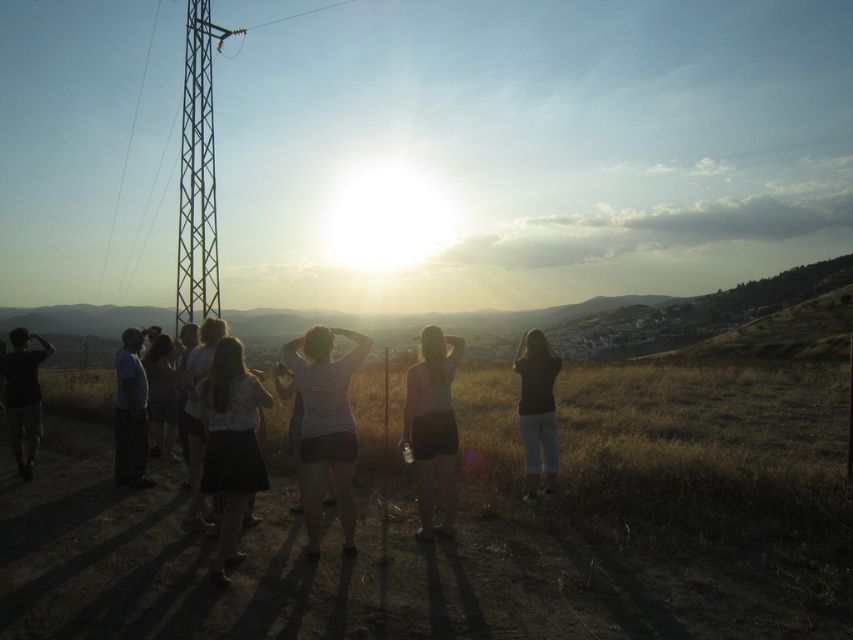
Is black cotton shirt at right above dark gray pants at left?

Yes, black cotton shirt at right is above dark gray pants at left.

Is black cotton shirt at right to the right of dark gray pants at left from the viewer's perspective?

Yes, black cotton shirt at right is to the right of dark gray pants at left.

Find the location of `black cotton shirt at right`. black cotton shirt at right is located at coordinates (537, 410).

Which of these two, silhouette group at center or black cotton shirt at right, stands shorter?

silhouette group at center

Is point (273, 513) behind point (515, 368)?

No.

Which is behind, point (733, 509) or point (524, 340)?

Positioned behind is point (524, 340).

This screenshot has width=853, height=640. Find the location of `silhouette group at center`. silhouette group at center is located at coordinates (479, 525).

Consider the image. Who is more distant from viewer, (193, 157) or (119, 404)?

The point (193, 157) is behind.

I want to click on metallic grid tower at left, so click(196, 172).